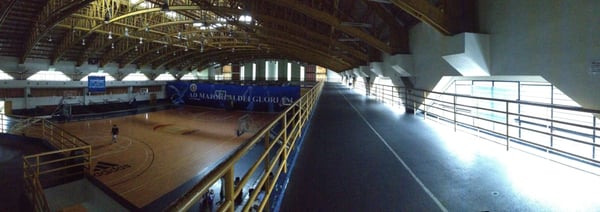
This screenshot has width=600, height=212. I want to click on blue wall mural, so click(x=248, y=91).